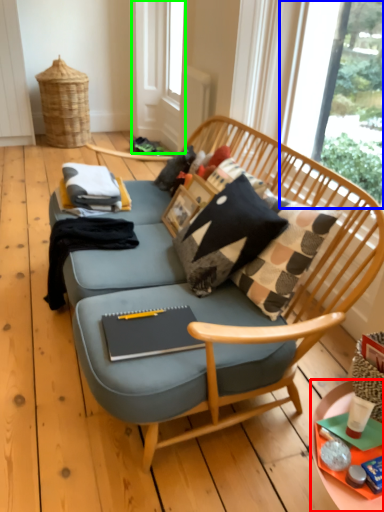
Question: Considering the real-world distances, which object is closest to desk (highlighted by a red box)? window screen (highlighted by a blue box) or screen door (highlighted by a green box).

Choices:
 (A) window screen
 (B) screen door

Answer: (A)